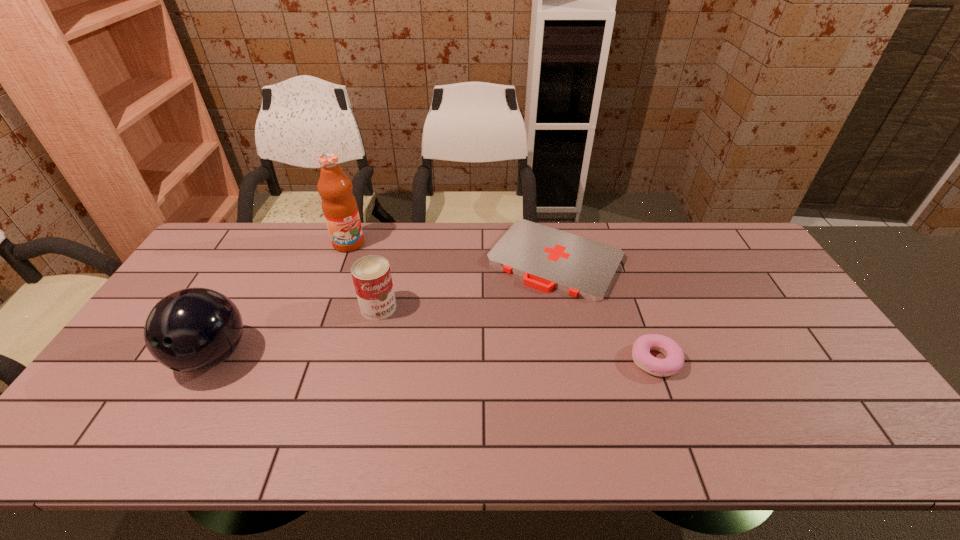
At what (x,y) coordinates should I click in order to perform the action: click on vacant space on the desktop that is between the bowling ball and the pastry and is positioned on handle side the first-aid kit. Please return your answer as a coordinate pair (x, y). Looking at the image, I should click on (490, 359).

What are the coordinates of `free space on the desktop that is between the bowling ball and the second shortest object and is positioned on the front label of the second object from left to right` in the screenshot? It's located at (416, 358).

This screenshot has width=960, height=540. In order to click on vacant space on the desktop that is between the bowling ball and the second shortest object and is positioned on the front label of the third tallest object in this screenshot , I will do `click(408, 357)`.